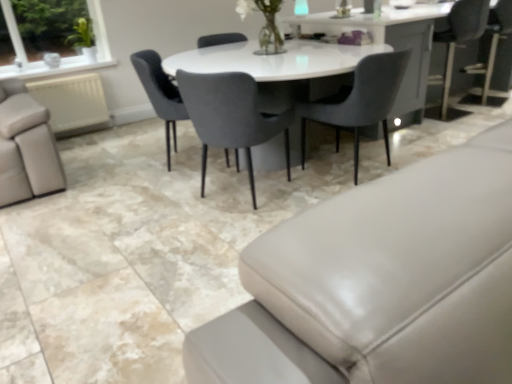
This screenshot has width=512, height=384. I want to click on vacant space in velvet grey chair at center, marked as the 2th chair in a right-to-left arrangement (from a real-world perspective), so click(x=238, y=196).